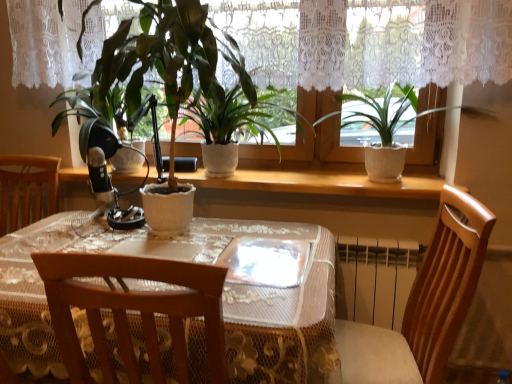
Locate an element on the screen. free location above white ceramic plant pot at center (from a real-world perspective) is located at coordinates (277, 174).